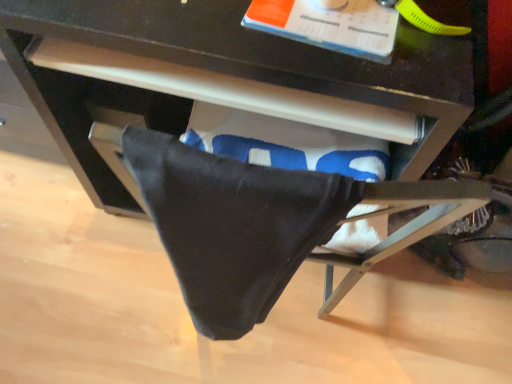
At what (x,y) coordinates should I click in order to perform the action: click on black cotton towel at lower center. Please return your answer as a coordinate pair (x, y). Image resolution: width=512 pixels, height=384 pixels. Looking at the image, I should click on (233, 225).

Image resolution: width=512 pixels, height=384 pixels. What do you see at coordinates (233, 225) in the screenshot? I see `black cotton towel at lower center` at bounding box center [233, 225].

At what (x,y) coordinates should I click in order to perform the action: click on matte black drawer at center. Please return your answer as a coordinate pair (x, y). The image size is (512, 384). Looking at the image, I should click on (222, 78).

The height and width of the screenshot is (384, 512). What do you see at coordinates (222, 78) in the screenshot?
I see `matte black drawer at center` at bounding box center [222, 78].

At what (x,y) coordinates should I click in order to perform the action: click on black cotton towel at lower center. Please return your answer as a coordinate pair (x, y). Looking at the image, I should click on (233, 225).

Looking at this image, considering the relative positions of black cotton towel at lower center and matte black drawer at center in the image provided, is black cotton towel at lower center to the right of matte black drawer at center from the viewer's perspective?

Indeed, black cotton towel at lower center is positioned on the right side of matte black drawer at center.

Which object is closer to the camera, black cotton towel at lower center or matte black drawer at center?

black cotton towel at lower center.

Which is in front, point (263, 198) or point (99, 178)?

Point (263, 198)

From the image's perspective, which is above, black cotton towel at lower center or matte black drawer at center?

matte black drawer at center, from the image's perspective.

From a real-world perspective, between black cotton towel at lower center and matte black drawer at center, who is vertically lower?

From a 3D spatial view, matte black drawer at center is below.

Which object is wider, black cotton towel at lower center or matte black drawer at center?

matte black drawer at center.

Is black cotton towel at lower center taller or shorter than matte black drawer at center?

In the image, black cotton towel at lower center appears to be shorter than matte black drawer at center.

Can you confirm if black cotton towel at lower center is smaller than matte black drawer at center?

Yes, black cotton towel at lower center is smaller than matte black drawer at center.

Would you say matte black drawer at center is part of black cotton towel at lower center's contents?

No, matte black drawer at center is located outside of black cotton towel at lower center.

Is black cotton towel at lower center positioned far away from matte black drawer at center?

No, black cotton towel at lower center is not far from matte black drawer at center.

Based on the photo, is black cotton towel at lower center aimed at matte black drawer at center?

No, black cotton towel at lower center is not oriented towards matte black drawer at center.

Can you tell me how much black cotton towel at lower center and matte black drawer at center differ in facing direction?

6.32 degrees separate the facing orientations of black cotton towel at lower center and matte black drawer at center.

At what (x,y) coordinates should I click in order to perform the action: click on blanket in front of the matte black drawer at center. Please return your answer as a coordinate pair (x, y). Looking at the image, I should click on (233, 225).

Which is more to the left, matte black drawer at center or black cotton towel at lower center?

Positioned to the left is matte black drawer at center.

Considering the positions of objects matte black drawer at center and black cotton towel at lower center in the image provided, who is behind, matte black drawer at center or black cotton towel at lower center?

matte black drawer at center.

Which is closer, (x=93, y=183) or (x=210, y=184)?

Point (x=93, y=183) is farther from the camera than point (x=210, y=184).

From the image's perspective, is matte black drawer at center positioned above or below black cotton towel at lower center?

From the image's perspective, matte black drawer at center appears above black cotton towel at lower center.

From a real-world perspective, who is located higher, matte black drawer at center or black cotton towel at lower center?

In real-world perspective, black cotton towel at lower center is above.

Which of these two, matte black drawer at center or black cotton towel at lower center, is thinner?

With smaller width is black cotton towel at lower center.

Does matte black drawer at center have a lesser height compared to black cotton towel at lower center?

In fact, matte black drawer at center may be taller than black cotton towel at lower center.

Considering the sizes of matte black drawer at center and black cotton towel at lower center in the image, is matte black drawer at center bigger or smaller than black cotton towel at lower center?

matte black drawer at center is bigger than black cotton towel at lower center.

Which is correct: matte black drawer at center is inside black cotton towel at lower center, or outside of it?

matte black drawer at center is spatially situated outside black cotton towel at lower center.

Is matte black drawer at center touching black cotton towel at lower center?

No, matte black drawer at center is not next to black cotton towel at lower center.

Is matte black drawer at center positioned with its back to black cotton towel at lower center?

No, black cotton towel at lower center is not at the back of matte black drawer at center.

Consider the image. How far apart are matte black drawer at center and black cotton towel at lower center?

matte black drawer at center and black cotton towel at lower center are 33.64 centimeters apart from each other.

In order to click on desk to the left of black cotton towel at lower center in this screenshot , I will do tap(222, 78).

There is a matte black drawer at center. At what (x,y) coordinates should I click in order to perform the action: click on blanket above it (from a real-world perspective). Please return your answer as a coordinate pair (x, y). Looking at the image, I should click on (233, 225).

Where is `blanket that appears on the right of matte black drawer at center`? Image resolution: width=512 pixels, height=384 pixels. blanket that appears on the right of matte black drawer at center is located at coordinates (233, 225).